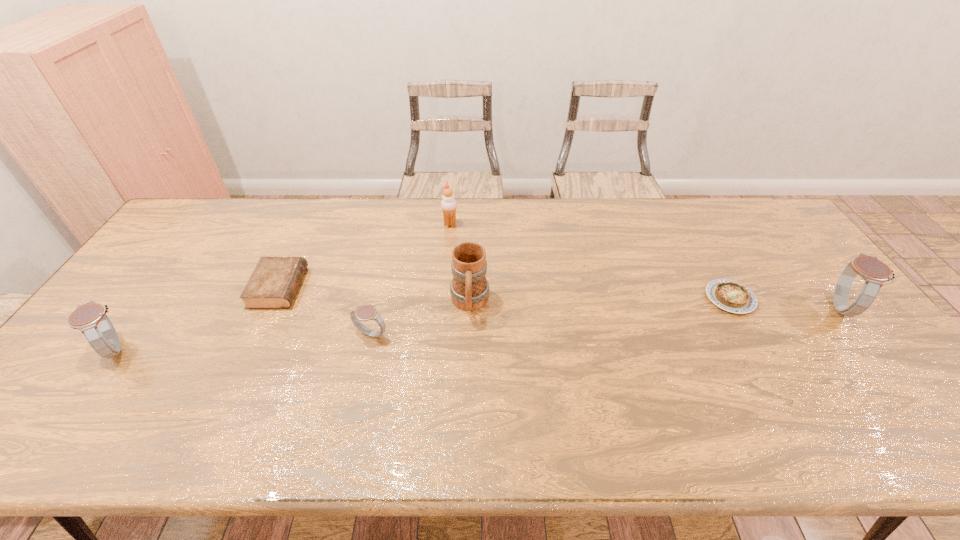
Find the location of a particular element. object situated at the right edge is located at coordinates (874, 272).

Locate an element on the screen. The image size is (960, 540). vacant area at the far edge is located at coordinates (539, 210).

What are the coordinates of `vacant space at the near edge of the desktop` in the screenshot? It's located at (407, 403).

Where is `vacant space at the far left corner of the desktop`? The image size is (960, 540). vacant space at the far left corner of the desktop is located at coordinates (216, 226).

Locate an element on the screen. This screenshot has height=540, width=960. vacant area between the diary and the shortest watch is located at coordinates (324, 310).

Where is `free spot between the leftmost watch and the rightmost watch`? The width and height of the screenshot is (960, 540). free spot between the leftmost watch and the rightmost watch is located at coordinates (478, 328).

The height and width of the screenshot is (540, 960). I want to click on free space between the second watch from right to left and the rightmost watch, so click(606, 320).

The width and height of the screenshot is (960, 540). I want to click on free space between the rightmost object and the quiche, so click(784, 302).

This screenshot has height=540, width=960. What are the coordinates of `empty space between the second watch from left to right and the quiche` in the screenshot? It's located at (550, 316).

Locate an element on the screen. This screenshot has width=960, height=540. free spot between the sixth object from left to right and the rightmost watch is located at coordinates [784, 302].